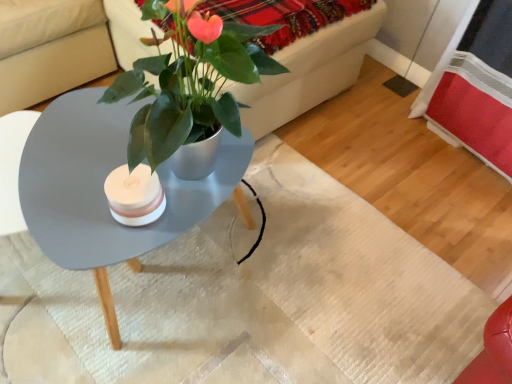
Question: Is metallic green plant at center outside matte gray coffee table at center?

Choices:
 (A) no
 (B) yes

Answer: (B)

Question: From a real-world perspective, is metallic green plant at center on top of matte gray coffee table at center?

Choices:
 (A) yes
 (B) no

Answer: (A)

Question: Is metallic green plant at center oriented away from matte gray coffee table at center?

Choices:
 (A) yes
 (B) no

Answer: (B)

Question: Considering the relative sizes of metallic green plant at center and matte gray coffee table at center in the image provided, is metallic green plant at center thinner than matte gray coffee table at center?

Choices:
 (A) no
 (B) yes

Answer: (A)

Question: From the image's perspective, is metallic green plant at center above matte gray coffee table at center?

Choices:
 (A) yes
 (B) no

Answer: (A)

Question: Is velvet red blanket at upper center inside the boundaries of metallic green plant at center, or outside?

Choices:
 (A) outside
 (B) inside

Answer: (B)

Question: From the image's perspective, is velvet red blanket at upper center above or below metallic green plant at center?

Choices:
 (A) above
 (B) below

Answer: (B)

Question: In terms of size, does velvet red blanket at upper center appear bigger or smaller than metallic green plant at center?

Choices:
 (A) small
 (B) big

Answer: (A)

Question: Is point (329, 23) closer or farther from the camera than point (168, 109)?

Choices:
 (A) closer
 (B) farther

Answer: (B)

Question: From their relative heights in the image, would you say matte gray coffee table at center is taller or shorter than metallic green plant at center?

Choices:
 (A) short
 (B) tall

Answer: (A)

Question: Based on their sizes in the image, would you say matte gray coffee table at center is bigger or smaller than metallic green plant at center?

Choices:
 (A) big
 (B) small

Answer: (B)

Question: Would you say matte gray coffee table at center is to the left or to the right of metallic green plant at center in the picture?

Choices:
 (A) left
 (B) right

Answer: (A)

Question: From a real-world perspective, is matte gray coffee table at center above or below metallic green plant at center?

Choices:
 (A) above
 (B) below

Answer: (B)

Question: Is point (x=228, y=74) positioned closer to the camera than point (x=322, y=14)?

Choices:
 (A) farther
 (B) closer

Answer: (B)

Question: Based on their sizes in the image, would you say metallic green plant at center is bigger or smaller than velvet red blanket at upper center?

Choices:
 (A) small
 (B) big

Answer: (B)